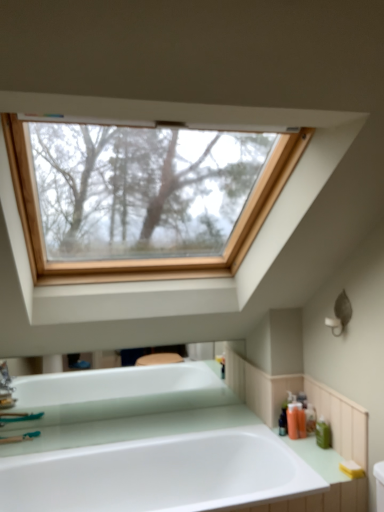
Locate an element on the screen. The image size is (384, 512). free space to the left of translucent plastic soap dispenser at right, placed as the second toiletry when sorted from back to front is located at coordinates (272, 433).